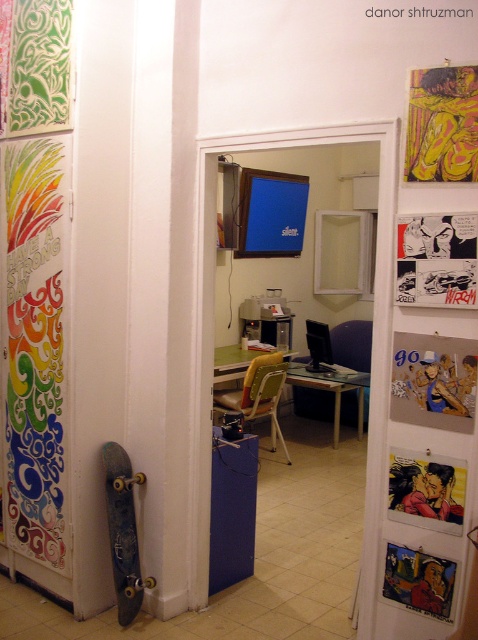
Is comic book page at upper right positioned in front of matte acrylic painting of two figures at center?

Yes.

In the scene shown: Can you confirm if comic book page at upper right is positioned to the right of matte acrylic painting of two figures at center?

Correct, you'll find comic book page at upper right to the right of matte acrylic painting of two figures at center.

This screenshot has height=640, width=478. Find the location of `comic book page at upper right`. comic book page at upper right is located at coordinates (436, 260).

Where is `comic book page at upper right`? The image size is (478, 640). comic book page at upper right is located at coordinates (436, 260).

Is rainbow swirls paper at left shorter than yellow textured fabric at upper right?

No, rainbow swirls paper at left is not shorter than yellow textured fabric at upper right.

Is rainbow swirls paper at left closer to the viewer compared to yellow textured fabric at upper right?

No, rainbow swirls paper at left is behind yellow textured fabric at upper right.

Identify the location of rainbow swirls paper at left. This screenshot has width=478, height=640. (34, 346).

Locate an element on the screen. rainbow swirls paper at left is located at coordinates (34, 346).

Is matte acrylic painting of two figures at center bigger than oil painting portrait at center?

Incorrect, matte acrylic painting of two figures at center is not larger than oil painting portrait at center.

Is matte acrylic painting of two figures at center positioned before oil painting portrait at center?

Yes.

Where is `matte acrylic painting of two figures at center`? Image resolution: width=478 pixels, height=640 pixels. matte acrylic painting of two figures at center is located at coordinates (426, 488).